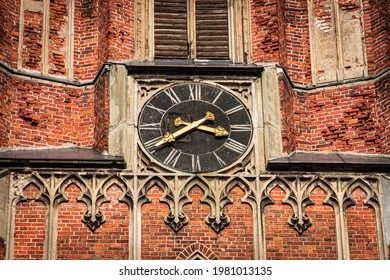
In order to click on clock hands in this screenshot , I will do `click(188, 126)`, `click(218, 128)`.